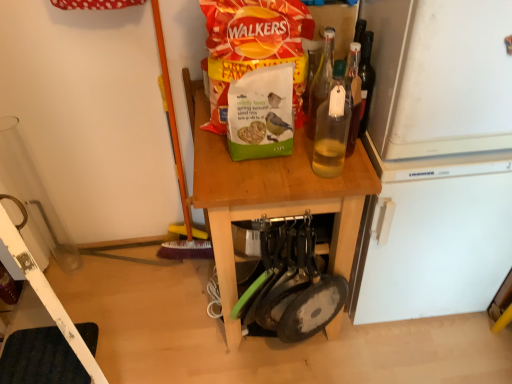
Question: Which direction should I rotate to look at transparent glass bottle at center, the second bottle when ordered from back to front?

Choices:
 (A) right
 (B) left

Answer: (A)

Question: From a real-world perspective, is white plastic ladder at lower left positioned over wooden table at center based on gravity?

Choices:
 (A) no
 (B) yes

Answer: (B)

Question: Is white plastic ladder at lower left shorter than wooden table at center?

Choices:
 (A) no
 (B) yes

Answer: (A)

Question: Can you confirm if white plastic ladder at lower left is thinner than wooden table at center?

Choices:
 (A) no
 (B) yes

Answer: (B)

Question: From the image's perspective, is white plastic ladder at lower left located above wooden table at center?

Choices:
 (A) no
 (B) yes

Answer: (A)

Question: Does white plastic ladder at lower left appear on the left side of wooden table at center?

Choices:
 (A) yes
 (B) no

Answer: (A)

Question: Can you confirm if white plastic ladder at lower left is positioned to the right of wooden table at center?

Choices:
 (A) no
 (B) yes

Answer: (A)

Question: Is transparent glass bottle at center, the second bottle when ordered from back to front, facing away from white plastic ladder at lower left?

Choices:
 (A) no
 (B) yes

Answer: (A)

Question: Is the position of transparent glass bottle at center, which appears as the first bottle when viewed from the front, more distant than that of white plastic ladder at lower left?

Choices:
 (A) yes
 (B) no

Answer: (A)

Question: Is transparent glass bottle at center, the second bottle when ordered from back to front, to the right of white plastic ladder at lower left from the viewer's perspective?

Choices:
 (A) no
 (B) yes

Answer: (B)

Question: Can you confirm if transparent glass bottle at center, which appears as the first bottle when viewed from the front, is smaller than white plastic ladder at lower left?

Choices:
 (A) no
 (B) yes

Answer: (B)

Question: Is transparent glass bottle at center, the second bottle when ordered from back to front, closer to camera compared to white plastic ladder at lower left?

Choices:
 (A) yes
 (B) no

Answer: (B)

Question: Does transparent glass bottle at center, the second bottle when ordered from back to front, contain white plastic ladder at lower left?

Choices:
 (A) no
 (B) yes

Answer: (A)

Question: From a real-world perspective, is green matte birdseed packet at center positioned over wooden table at center based on gravity?

Choices:
 (A) no
 (B) yes

Answer: (B)